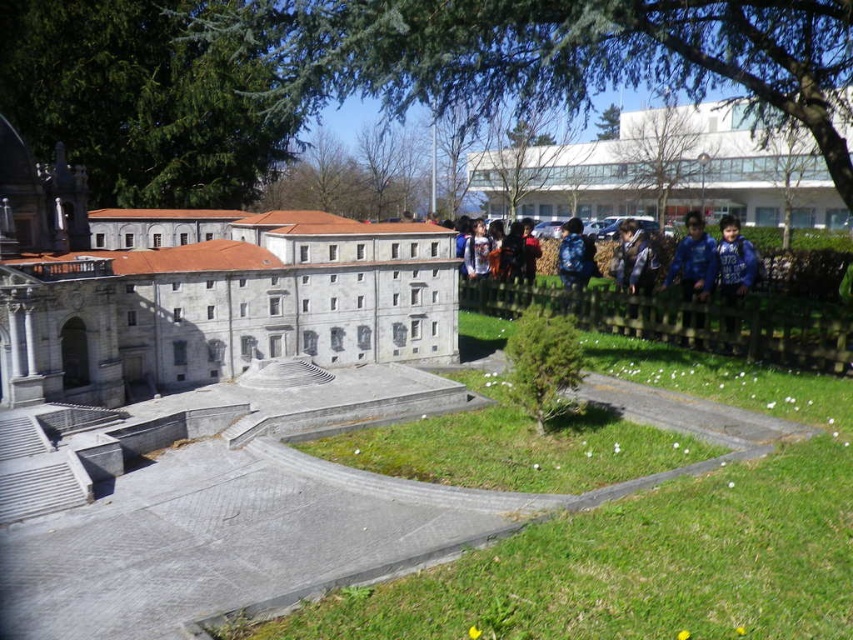
Between blue denim jacket at center and blue backpack at center, which one appears on the left side from the viewer's perspective?

From the viewer's perspective, blue backpack at center appears more on the left side.

Which is behind, point (635, 282) or point (582, 257)?

The point (582, 257) is more distant.

Locate an element on the screen. The image size is (853, 640). blue denim jacket at center is located at coordinates (630, 257).

Between blue fabric shirt at right and blue backpack at center, which one is positioned lower?

Positioned lower is blue fabric shirt at right.

In the scene shown: Is blue fabric shirt at right taller than blue backpack at center?

Yes, blue fabric shirt at right is taller than blue backpack at center.

Who is more forward, (740, 296) or (561, 237)?

Point (740, 296)

At what (x,y) coordinates should I click in order to perform the action: click on blue fabric shirt at right. Please return your answer as a coordinate pair (x, y). Looking at the image, I should click on (733, 262).

Does white glass building at center appear on the left side of blue backpack at center?

No, white glass building at center is not to the left of blue backpack at center.

Which is below, white glass building at center or blue backpack at center?

blue backpack at center

Is point (816, 195) more distant than point (573, 240)?

Yes, point (816, 195) is farther from viewer.

Image resolution: width=853 pixels, height=640 pixels. What are the coordinates of `white glass building at center` in the screenshot? It's located at (664, 172).